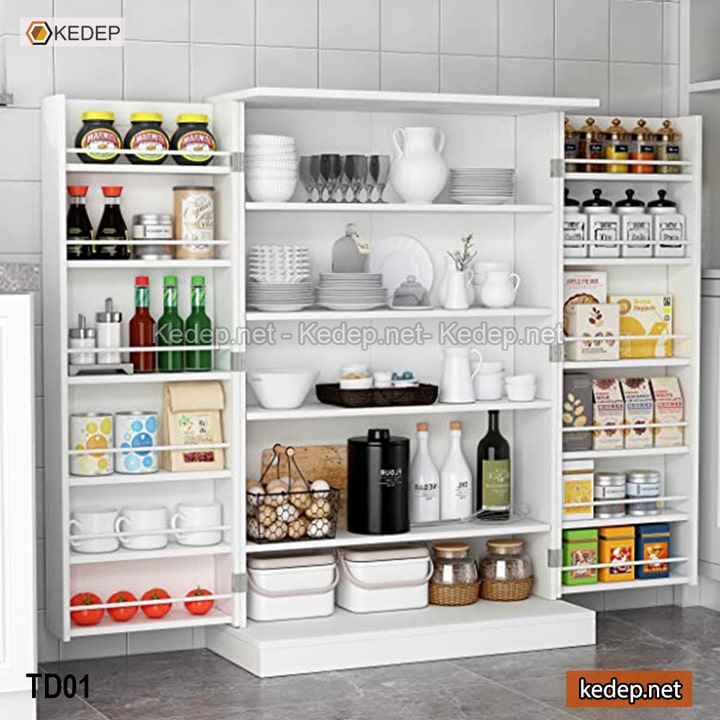
The width and height of the screenshot is (720, 720). What are the coordinates of `condiment dishes` in the screenshot? It's located at (356, 382), (354, 366), (381, 376), (397, 381).